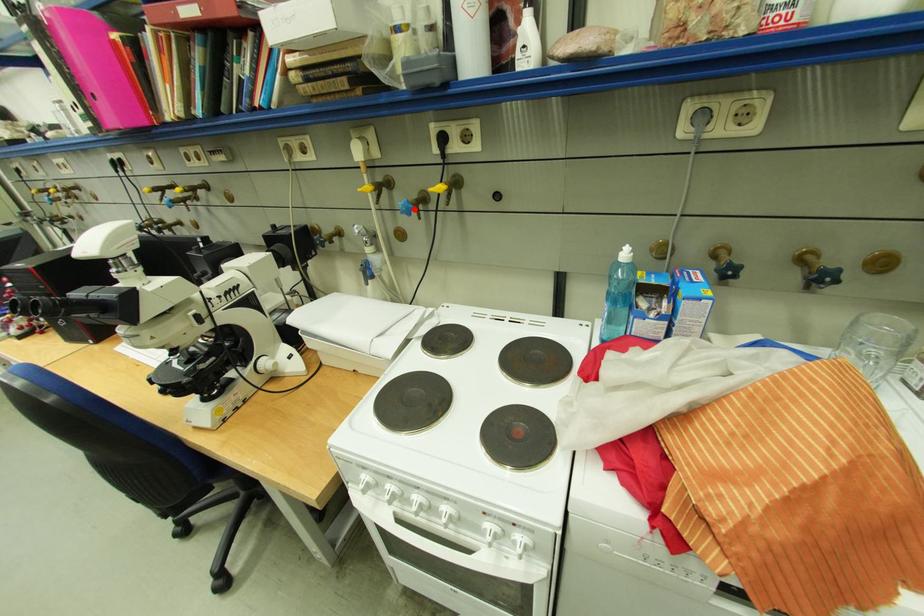
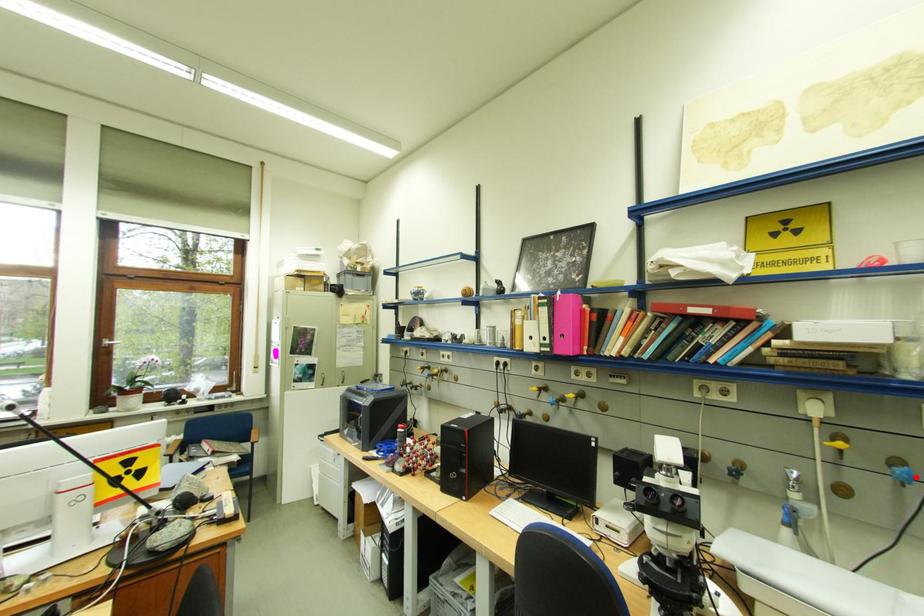
I am providing you with two images of the same scene from different viewpoints. A red point is marked on the first image and another point is marked on the second image. Is the marked point in image1 the same physical position as the marked point in image2?

Yes